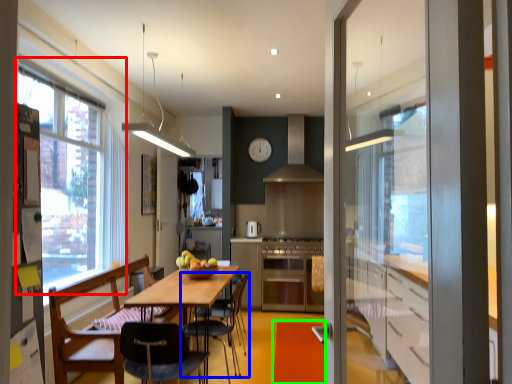
Question: Which is nearer to the window (highlighted by a red box)? chair (highlighted by a blue box) or plain (highlighted by a green box).

Choices:
 (A) chair
 (B) plain

Answer: (A)